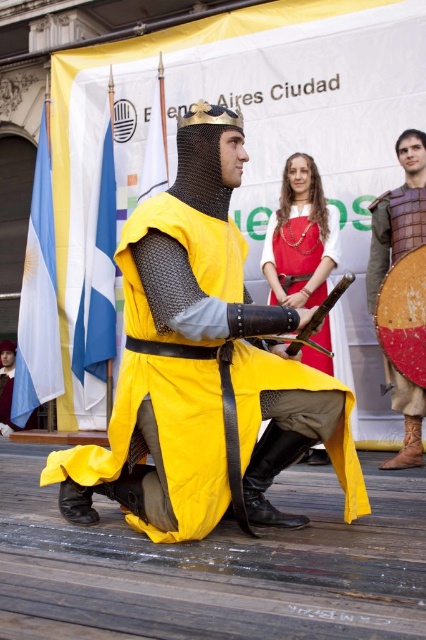
Question: Which point appears farthest from the camera in this image?

Choices:
 (A) (425, 340)
 (B) (330, 346)
 (C) (287, 346)
 (D) (239, 307)

Answer: (B)

Question: Does matte gold chainmail helmet at center appear under white fabric flag at left?

Choices:
 (A) yes
 (B) no

Answer: (A)

Question: Considering the relative positions of matte gold chainmail helmet at center and yellow fabric shield at center in the image provided, where is matte gold chainmail helmet at center located with respect to yellow fabric shield at center?

Choices:
 (A) below
 (B) above

Answer: (A)

Question: Does yellow fabric shield at center lie behind wooden sword at center?

Choices:
 (A) no
 (B) yes

Answer: (B)

Question: Which point is farther from the camera taking this photo?

Choices:
 (A) (46, 268)
 (B) (55, 477)
 (C) (308, 332)
 (D) (313, 285)

Answer: (A)

Question: Among these objects, which one is farthest from the camera?

Choices:
 (A) wooden sword at center
 (B) wooden shield at center

Answer: (B)